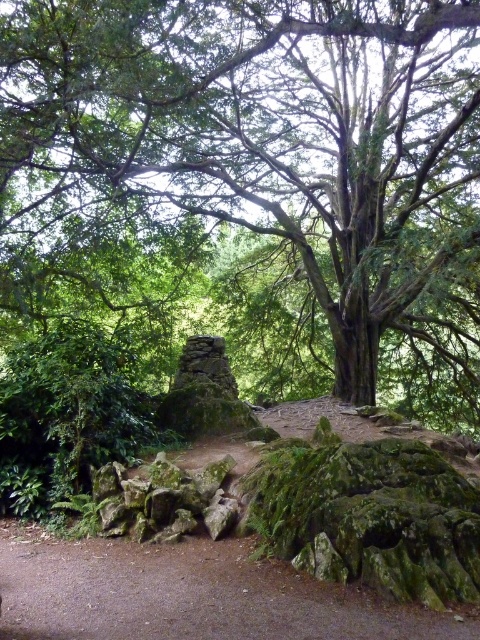
Who is positioned more to the right, green leafy tree at center or brown dirt path at center?

green leafy tree at center is more to the right.

Between green leafy tree at center and brown dirt path at center, which one has more height?

Standing taller between the two is green leafy tree at center.

You are a GUI agent. You are given a task and a screenshot of the screen. Output one action in this format:
    pyautogui.click(x=<x>, y=<y>)
    Task: Click on the green leafy tree at center
    The image size is (480, 640).
    Given the screenshot: What is the action you would take?
    pyautogui.click(x=274, y=140)